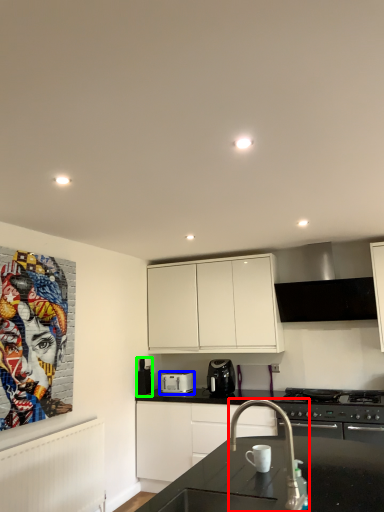
Question: Estimate the real-world distances between objects in this image. Which object is farther from tap (highlighted by a red box), kitchen appliance (highlighted by a blue box) or appliance (highlighted by a green box)?

Choices:
 (A) kitchen appliance
 (B) appliance

Answer: (B)